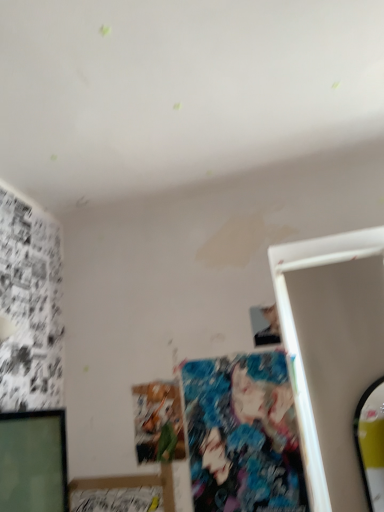
Question: Could you tell me if smooth black phone at upper right is facing matte paper poster at center, positioned as the 2th art in right-to-left order?

Choices:
 (A) yes
 (B) no

Answer: (B)

Question: Considering the relative positions of smooth black phone at upper right and matte paper poster at center, positioned as the 2th art in right-to-left order, in the image provided, is smooth black phone at upper right behind matte paper poster at center, positioned as the 2th art in right-to-left order,?

Choices:
 (A) no
 (B) yes

Answer: (B)

Question: Is smooth black phone at upper right shorter than matte paper poster at center, which is counted as the 1th art, starting from the left?

Choices:
 (A) no
 (B) yes

Answer: (B)

Question: Does smooth black phone at upper right have a greater width compared to matte paper poster at center, positioned as the 2th art in right-to-left order?

Choices:
 (A) no
 (B) yes

Answer: (A)

Question: From the image's perspective, would you say smooth black phone at upper right is positioned over matte paper poster at center, positioned as the 2th art in right-to-left order?

Choices:
 (A) yes
 (B) no

Answer: (A)

Question: From a real-world perspective, is smooth black phone at upper right positioned under matte paper poster at center, positioned as the 2th art in right-to-left order, based on gravity?

Choices:
 (A) no
 (B) yes

Answer: (A)

Question: Is the surface of matte paper poster at center, positioned as the 2th art in right-to-left order, in direct contact with smooth black phone at upper right?

Choices:
 (A) yes
 (B) no

Answer: (B)

Question: Considering the relative sizes of matte paper poster at center, which is counted as the 1th art, starting from the left, and smooth black phone at upper right in the image provided, is matte paper poster at center, which is counted as the 1th art, starting from the left, taller than smooth black phone at upper right?

Choices:
 (A) yes
 (B) no

Answer: (A)

Question: Can you confirm if matte paper poster at center, which is counted as the 1th art, starting from the left, is shorter than smooth black phone at upper right?

Choices:
 (A) no
 (B) yes

Answer: (A)

Question: From the image's perspective, is matte paper poster at center, positioned as the 2th art in right-to-left order, below smooth black phone at upper right?

Choices:
 (A) no
 (B) yes

Answer: (B)

Question: Considering the relative positions of matte paper poster at center, which is counted as the 1th art, starting from the left, and smooth black phone at upper right in the image provided, is matte paper poster at center, which is counted as the 1th art, starting from the left, to the left of smooth black phone at upper right from the viewer's perspective?

Choices:
 (A) yes
 (B) no

Answer: (A)

Question: From a real-world perspective, is matte paper poster at center, which is counted as the 1th art, starting from the left, located higher than smooth black phone at upper right?

Choices:
 (A) no
 (B) yes

Answer: (A)

Question: Considering the relative sizes of matte paper poster at center, positioned as the 2th art in right-to-left order, and colorful fabric poster at center, acting as the 1th art starting from the right, in the image provided, is matte paper poster at center, positioned as the 2th art in right-to-left order, bigger than colorful fabric poster at center, acting as the 1th art starting from the right,?

Choices:
 (A) yes
 (B) no

Answer: (B)